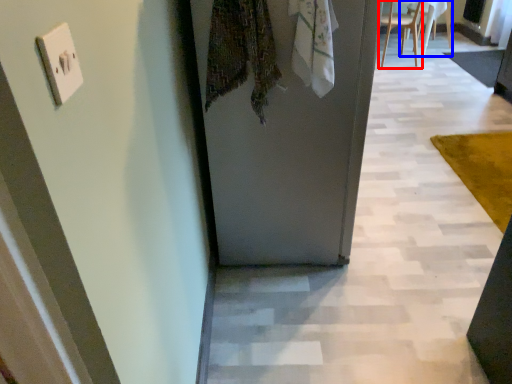
Question: Which of the following is the farthest to the observer, chair (highlighted by a red box) or chair (highlighted by a blue box)?

Choices:
 (A) chair
 (B) chair

Answer: (B)